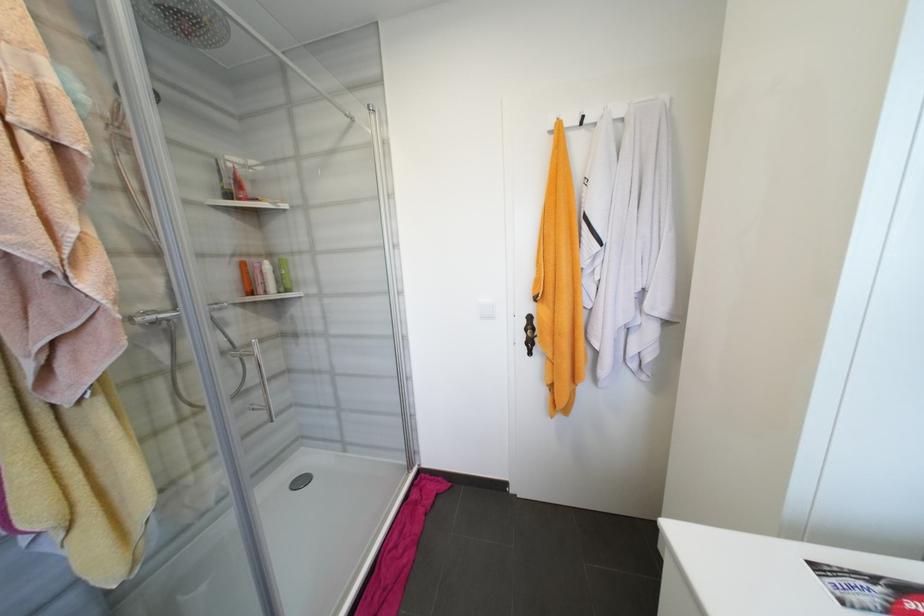
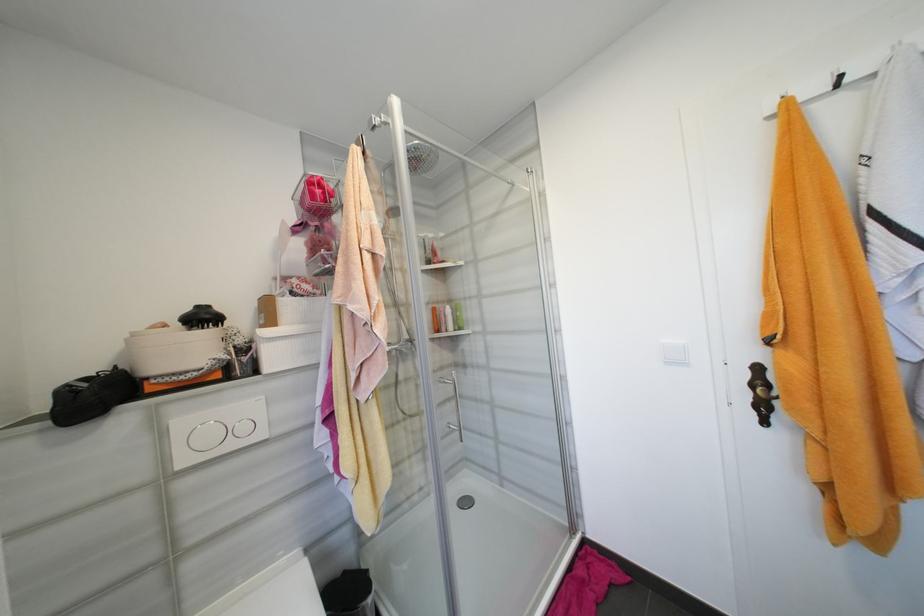
In the second image, find the point that corresponds to the point at 536,318 in the first image.

(763, 370)